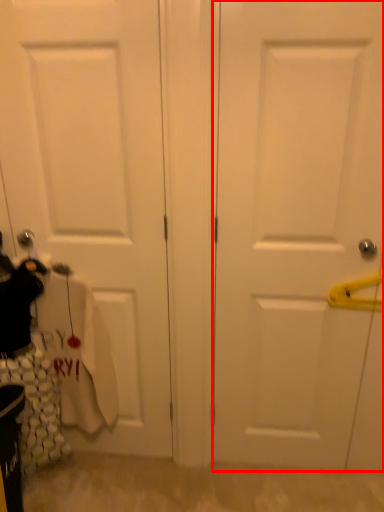
Question: Considering the relative positions of door (annotated by the red box) and door in the image provided, where is door (annotated by the red box) located with respect to the staircase?

Choices:
 (A) left
 (B) right

Answer: (B)